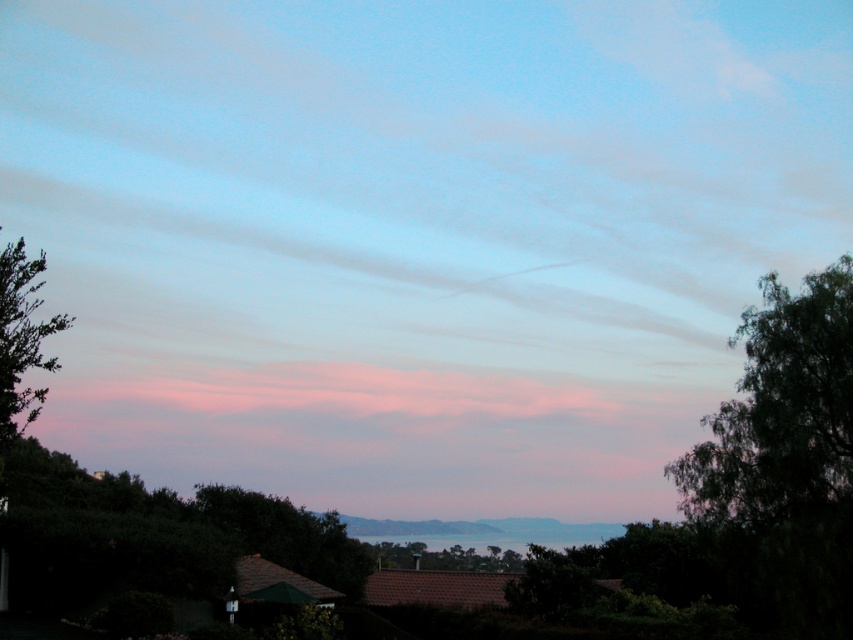
You are standing at the viewpoint of the image and want to determine the spatial relationship between the two points. Which point is closer to you, point (32, 310) or point (378, 563)?

Point (32, 310) is in front of point (378, 563), so it is closer to you.